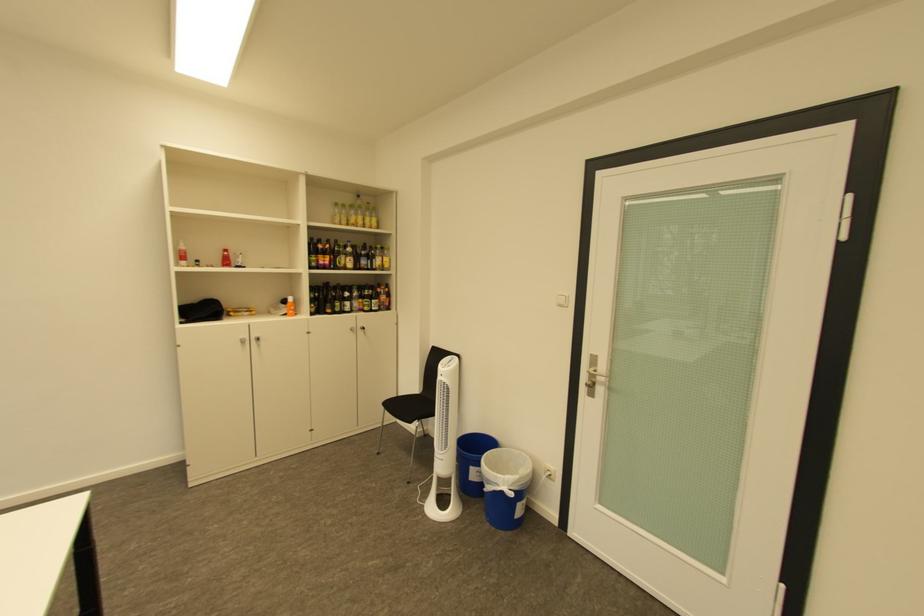
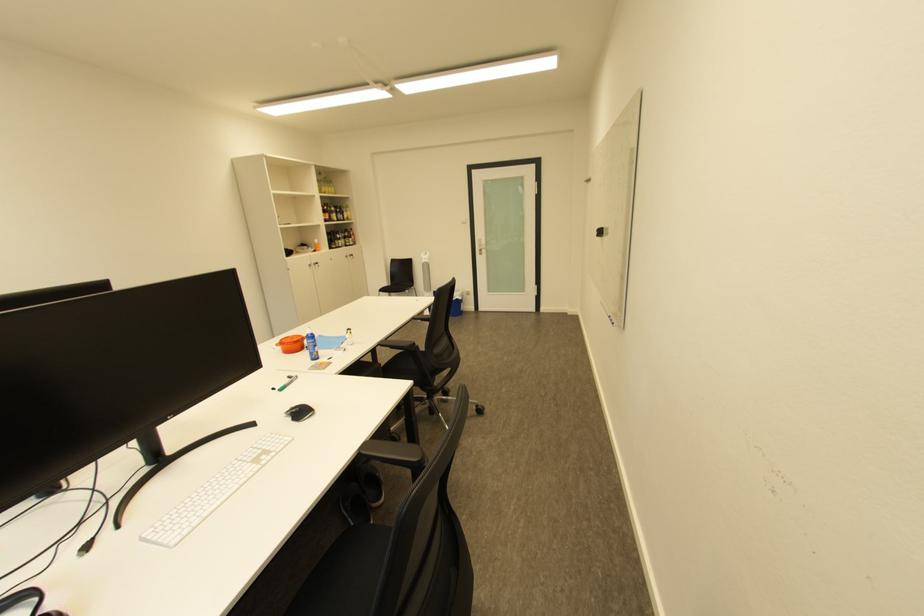
Find the pixel in the second image that matches point 321,276 in the first image.

(335, 225)